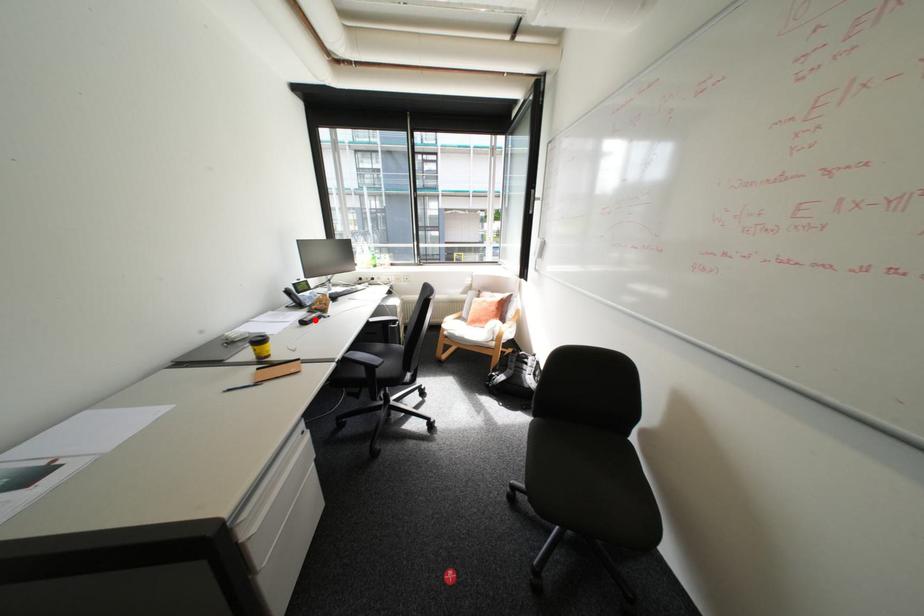
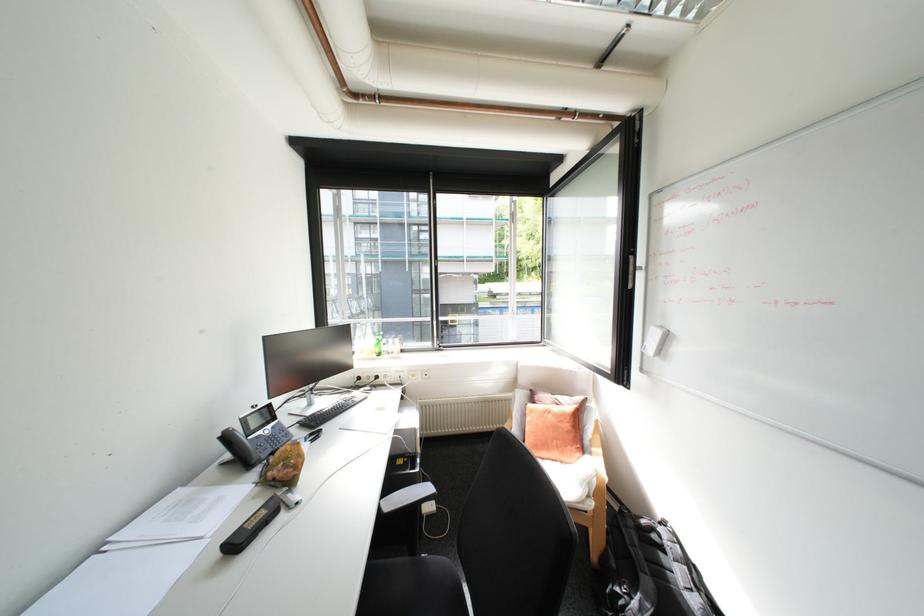
Question: I am providing you with two images of the same scene from different viewpoints. A red point is marked on the first image. At the location where the point appears in image 1, is it still visible in image 2?

Choices:
 (A) Yes
 (B) No

Answer: (A)